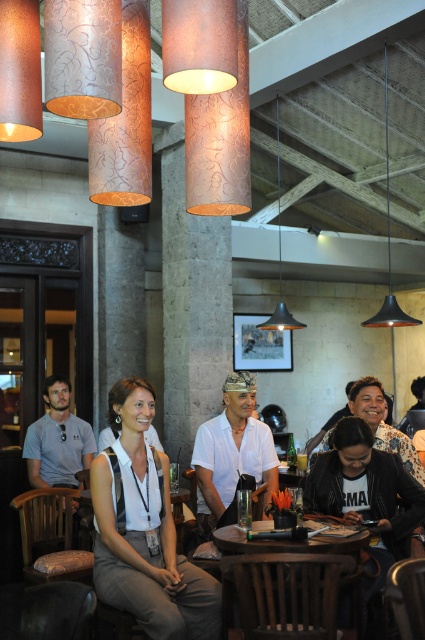
Question: Can you confirm if black leather jacket at lower right is positioned above white matte shirt at center?

Choices:
 (A) yes
 (B) no

Answer: (B)

Question: Estimate the real-world distances between objects in this image. Which object is closer to the black leather jacket at lower right?

Choices:
 (A) white fabric shirt at center
 (B) wooden table at center
 (C) white matte shirt at center

Answer: (B)

Question: Can you confirm if white matte shirt at center is positioned below metallic pendant light at center?

Choices:
 (A) no
 (B) yes

Answer: (B)

Question: Does black leather jacket at lower right appear on the left side of black matte pendant light at upper right?

Choices:
 (A) no
 (B) yes

Answer: (B)

Question: Which object is the farthest from the metallic pendant light at center?

Choices:
 (A) white fabric shirt at center
 (B) white matte shirt at center
 (C) black leather jacket at lower right
 (D) gray cotton shirt at left

Answer: (A)

Question: Which object is positioned farthest from the gray cotton shirt at left?

Choices:
 (A) metallic pendant light at center
 (B) wooden table at center
 (C) white matte shirt at center

Answer: (B)